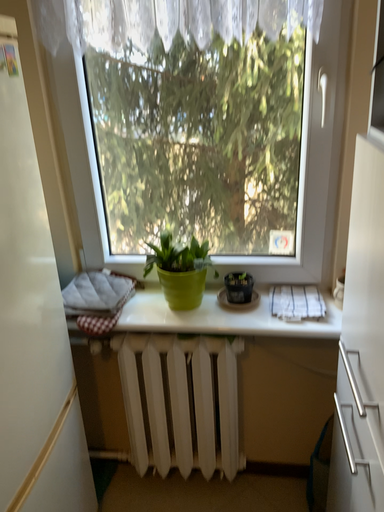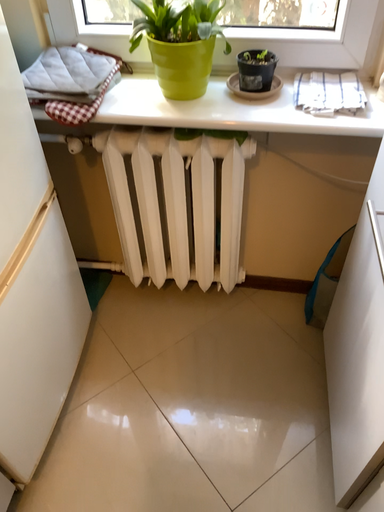
Question: How did the camera likely rotate when shooting the video?

Choices:
 (A) rotated upward
 (B) rotated downward

Answer: (B)